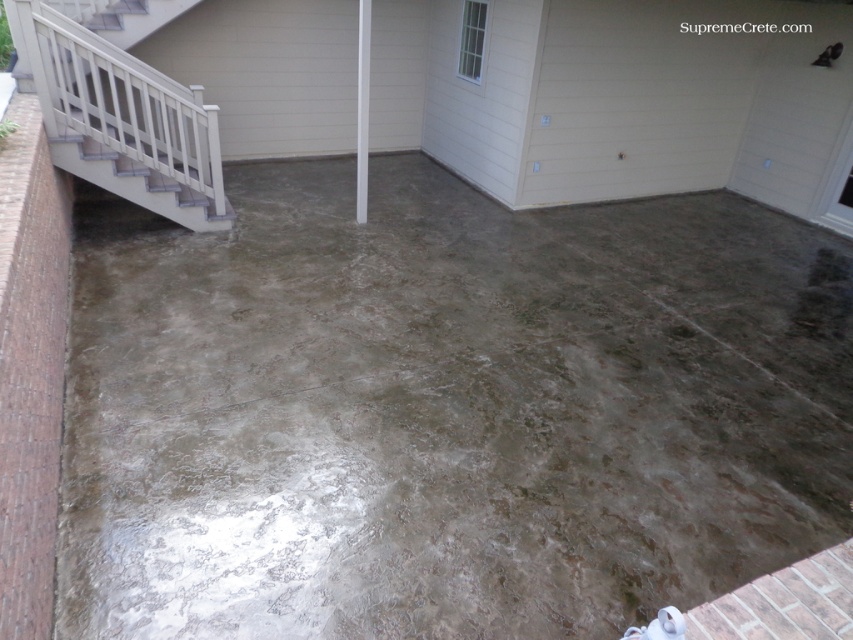
Can you confirm if textured concrete at center is smaller than white smooth pole at center?

Yes, textured concrete at center is smaller than white smooth pole at center.

Is point (561, 243) farther from camera compared to point (366, 179)?

That is False.

Identify the location of textured concrete at center. (444, 410).

The height and width of the screenshot is (640, 853). Describe the element at coordinates (444, 410) in the screenshot. I see `textured concrete at center` at that location.

Is point (520, 417) closer to camera compared to point (57, 115)?

Yes.

The height and width of the screenshot is (640, 853). In order to click on textured concrete at center in this screenshot , I will do `click(444, 410)`.

Is point (78, 45) less distant than point (363, 109)?

Yes, it is.

Which of these two, white painted wood stairs at upper left or white smooth pole at center, stands shorter?

With less height is white smooth pole at center.

Locate an element on the screen. white painted wood stairs at upper left is located at coordinates (123, 118).